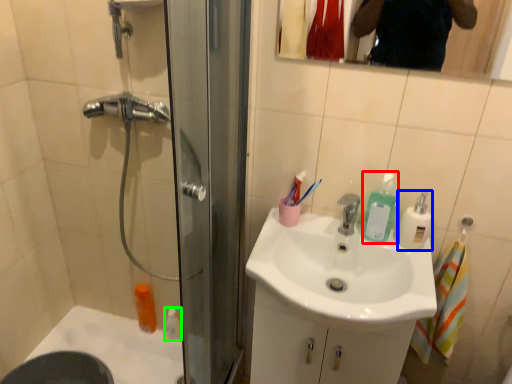
Question: Which object is the farthest from soap dispenser (highlighted by a red box)? Choose among these: soap dispenser (highlighted by a blue box) or toiletry (highlighted by a green box).

Choices:
 (A) soap dispenser
 (B) toiletry

Answer: (B)